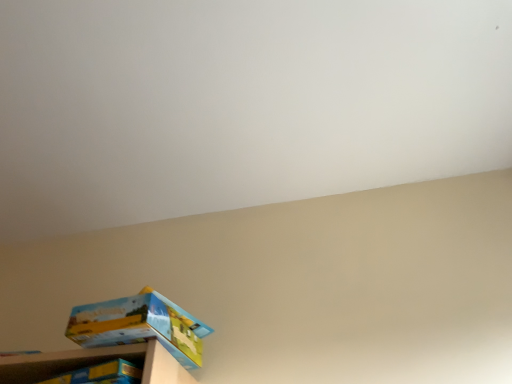
Question: Should I look upward or downward to see matte cardboard box at lower left?

Choices:
 (A) down
 (B) up

Answer: (A)

Question: Is wooden shelf at lower left far from matte cardboard box at lower left?

Choices:
 (A) yes
 (B) no

Answer: (B)

Question: Can you confirm if wooden shelf at lower left is shorter than matte cardboard box at lower left?

Choices:
 (A) yes
 (B) no

Answer: (A)

Question: Is the depth of wooden shelf at lower left less than that of matte cardboard box at lower left?

Choices:
 (A) yes
 (B) no

Answer: (A)

Question: From the image's perspective, would you say wooden shelf at lower left is positioned over matte cardboard box at lower left?

Choices:
 (A) yes
 (B) no

Answer: (B)

Question: Considering the relative sizes of wooden shelf at lower left and matte cardboard box at lower left in the image provided, is wooden shelf at lower left thinner than matte cardboard box at lower left?

Choices:
 (A) no
 (B) yes

Answer: (A)

Question: Could matte cardboard box at lower left be considered to be inside wooden shelf at lower left?

Choices:
 (A) yes
 (B) no

Answer: (B)

Question: Does matte cardboard box at lower left have a greater width compared to wooden shelf at lower left?

Choices:
 (A) no
 (B) yes

Answer: (A)

Question: Is matte cardboard box at lower left taller than wooden shelf at lower left?

Choices:
 (A) yes
 (B) no

Answer: (A)

Question: From a real-world perspective, is matte cardboard box at lower left under wooden shelf at lower left?

Choices:
 (A) yes
 (B) no

Answer: (B)

Question: Is matte cardboard box at lower left facing towards wooden shelf at lower left?

Choices:
 (A) yes
 (B) no

Answer: (B)

Question: From a real-world perspective, is matte cardboard box at lower left physically above wooden shelf at lower left?

Choices:
 (A) no
 (B) yes

Answer: (B)

Question: Can you see matte cardboard box at lower left touching wooden shelf at lower left?

Choices:
 (A) no
 (B) yes

Answer: (B)

Question: From their relative heights in the image, would you say wooden shelf at lower left is taller or shorter than matte cardboard box at lower left?

Choices:
 (A) tall
 (B) short

Answer: (B)